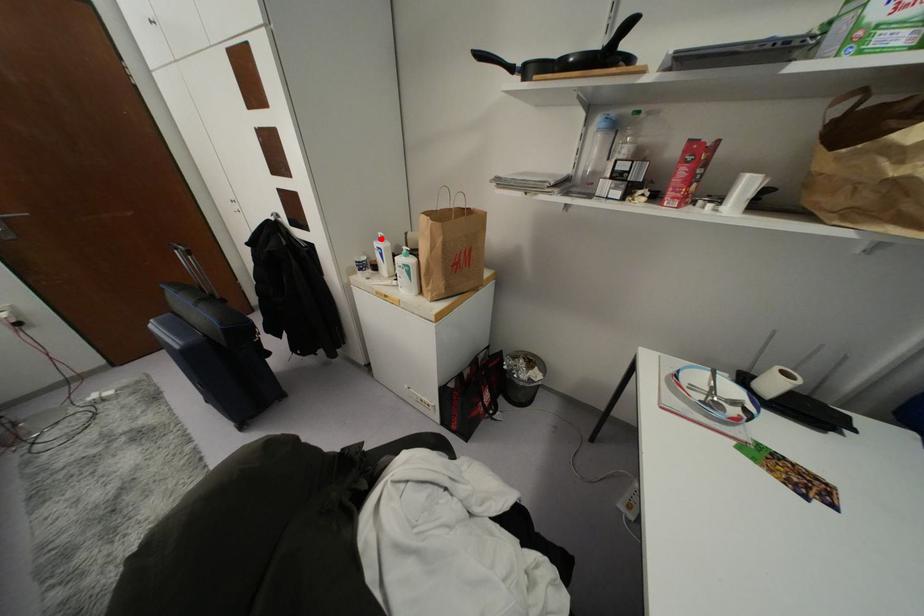
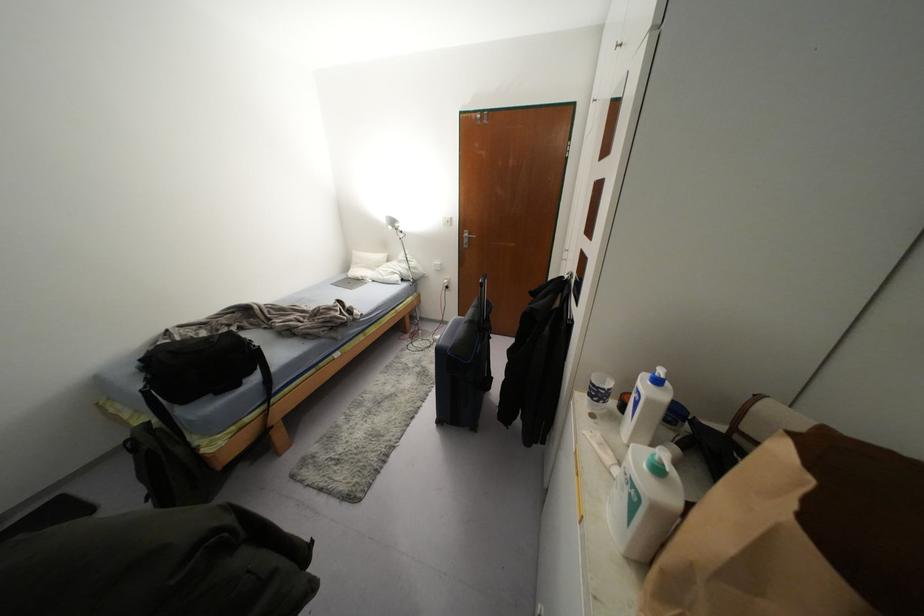
Where in the second image is the point corresponding to the highlighted location from the first image?

(658, 381)